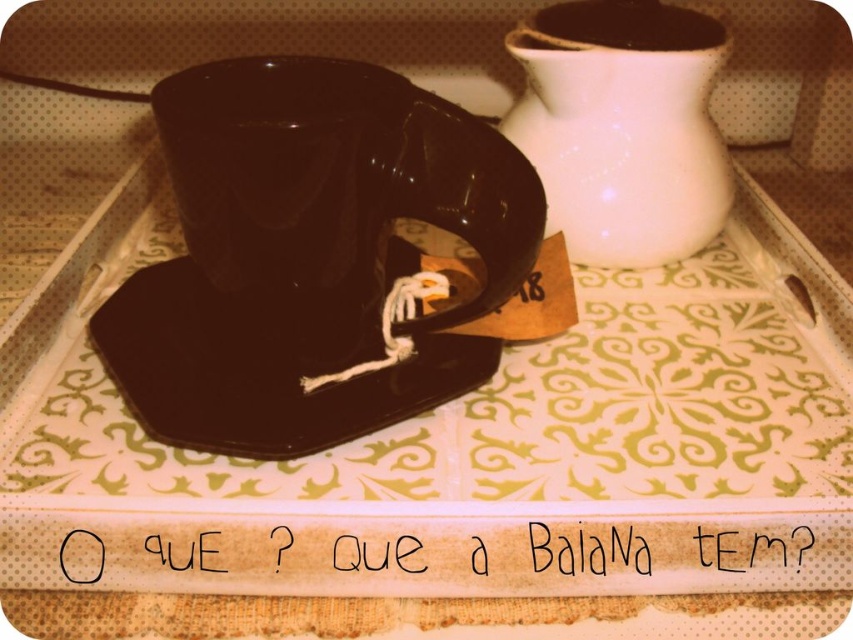
Measure the distance between point [672,157] and camera.

Point [672,157] is 32.10 inches from camera.

Is point (612, 96) closer to camera compared to point (534, 12)?

Yes, it is.

Where is `white glossy jug at upper right`? The width and height of the screenshot is (853, 640). white glossy jug at upper right is located at coordinates (622, 128).

Based on the photo, who is more distant from viewer, (192, 278) or (654, 29)?

The point (654, 29) is more distant.

This screenshot has height=640, width=853. What do you see at coordinates (267, 364) in the screenshot? I see `glossy ceramic saucer at center` at bounding box center [267, 364].

This screenshot has width=853, height=640. In order to click on glossy ceramic saucer at center in this screenshot , I will do `click(267, 364)`.

Can you confirm if glossy ceramic mug at upper center is positioned above glossy ceramic coffee cup at upper center?

No, glossy ceramic mug at upper center is not above glossy ceramic coffee cup at upper center.

In the scene shown: Is glossy ceramic mug at upper center bigger than glossy ceramic coffee cup at upper center?

Yes, glossy ceramic mug at upper center is bigger than glossy ceramic coffee cup at upper center.

Between point (403, 141) and point (602, 44), which one is positioned behind?

The point (602, 44) is behind.

Where is `glossy ceramic mug at upper center`? The height and width of the screenshot is (640, 853). glossy ceramic mug at upper center is located at coordinates (338, 179).